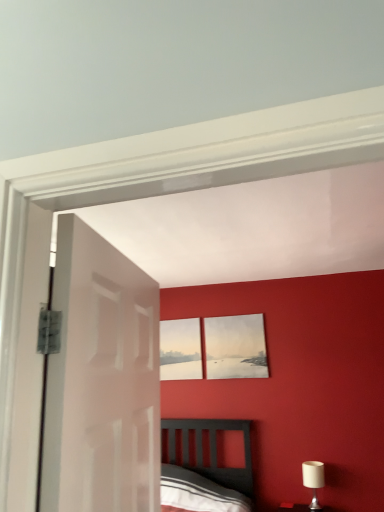
Question: In terms of width, does matte gray picture frame at upper center, the first picture frame positioned from the right, look wider or thinner when compared to white glossy door at left?

Choices:
 (A) thin
 (B) wide

Answer: (A)

Question: Does point 211,369 appear closer or farther from the camera than point 77,438?

Choices:
 (A) farther
 (B) closer

Answer: (A)

Question: Estimate the real-world distances between objects in this image. Which object is farther from the matte gray picture frame at upper center, the first picture frame positioned from the right?

Choices:
 (A) white fabric-covered lampshade at lower right
 (B) white glossy door at left
 (C) matte white picture frame at center, the 1th picture frame positioned from the left

Answer: (B)

Question: Estimate the real-world distances between objects in this image. Which object is closer to the white glossy door at left?

Choices:
 (A) matte gray picture frame at upper center, the first picture frame positioned from the right
 (B) matte white picture frame at center, the second picture frame positioned from the right
 (C) white fabric-covered lampshade at lower right

Answer: (A)